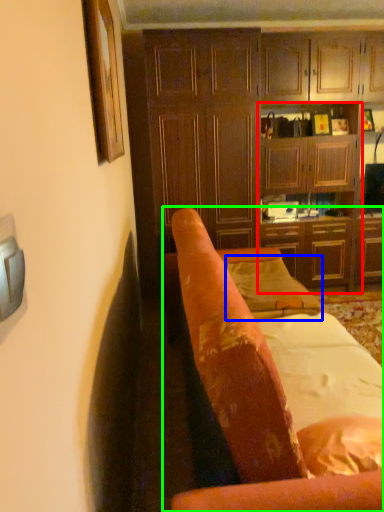
Question: Considering the real-world distances, which object is farthest from tv cabinet (highlighted by a red box)? pillow (highlighted by a blue box) or chair (highlighted by a green box)?

Choices:
 (A) pillow
 (B) chair

Answer: (B)